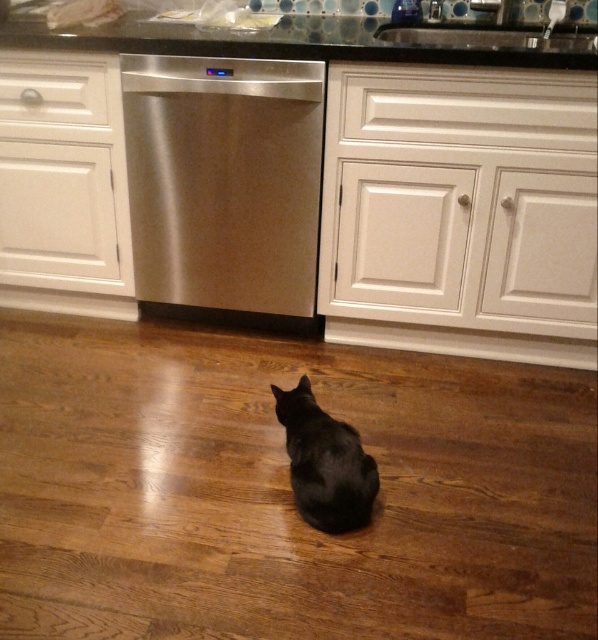
You are a delivery person trying to place a new microwave on the kitchen counter. The microwave is the same size as the stainless steel dishwasher at center. Will it fit on the glassy granite countertop at upper center?

The stainless steel dishwasher at center is smaller than the glassy granite countertop at upper center. Since the microwave is the same size as the dishwasher, it will fit on the glassy granite countertop at upper center.

You are a delivery person entering the kitchen and need to place a package on the counter behind the stainless steel dishwasher at center and the black fur cat at center. Which direction should you move relative to the cat to reach the counter?

Since the stainless steel dishwasher at center is to the left of the black fur cat at center, you should move to the right of the cat to reach the counter behind the dishwasher.

You are a pet sitter tasked with feeding the black fur cat at center. The cat is currently sitting on the polished wooden floor facing the stainless steel dishwasher at center. To reach the cat food bowl, you need to walk around the dishwasher. Since the dishwasher is taller than the cat, will you have to bend down to look at the cat while walking around it?

The stainless steel dishwasher at center is taller than the black fur cat at center, so yes, you will have to bend down to look at the cat while walking around the dishwasher since it is taller than the cat.